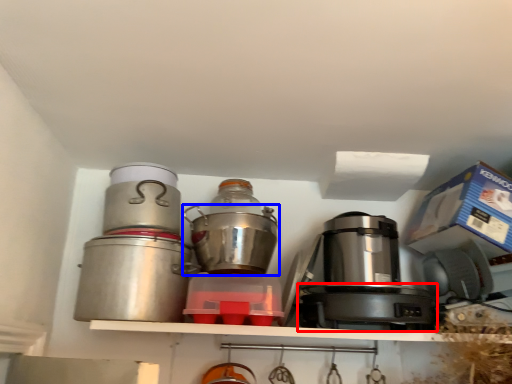
Question: Which object is closer to the camera taking this photo, appliance (highlighted by a red box) or kitchen appliance (highlighted by a blue box)?

Choices:
 (A) appliance
 (B) kitchen appliance

Answer: (A)